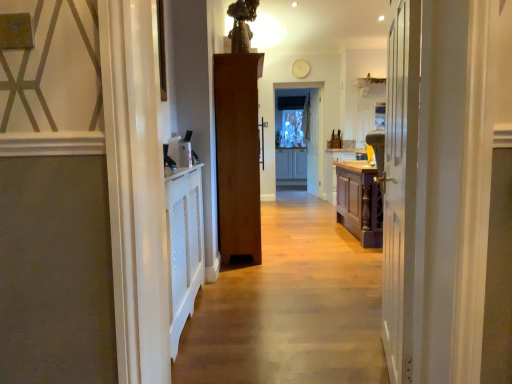
Question: Considering the positions of white wooden door at center, the 1th door viewed from the back, and white wooden door at center, acting as the first door starting from the front, in the image, is white wooden door at center, the 1th door viewed from the back, wider or thinner than white wooden door at center, acting as the first door starting from the front,?

Choices:
 (A) thin
 (B) wide

Answer: (A)

Question: Choose the correct answer: Is white wooden door at center, the 3th door when ordered from front to back, inside white wooden door at center, the second door in the right-to-left sequence, or outside it?

Choices:
 (A) inside
 (B) outside

Answer: (B)

Question: Which object is the closest to the white wooden door at center, which is counted as the second door, starting from the left?

Choices:
 (A) white wooden door at center, the 1th door viewed from the back
 (B) brown wooden door at center, marked as the third door in a right-to-left arrangement
 (C) wooden cabinet at center
 (D) wooden floor at center
 (E) clear glass screen door at center

Answer: (D)

Question: Which is farther from the white wooden door at center, the 1th door viewed from the back?

Choices:
 (A) wooden floor at center
 (B) clear glass screen door at center
 (C) wooden cabinet at center
 (D) white wooden door at center, the second door in the right-to-left sequence
 (E) brown wooden door at center, marked as the third door in a right-to-left arrangement

Answer: (D)